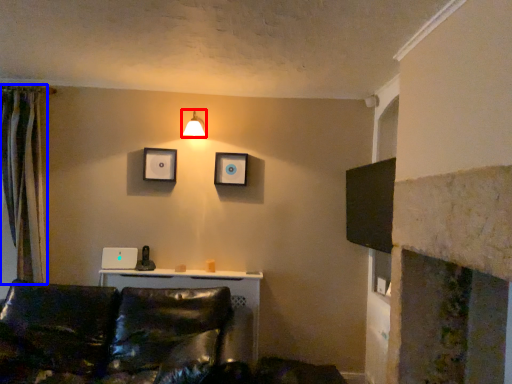
Question: Which of the following is the farthest to the observer, light fixture (highlighted by a red box) or curtain (highlighted by a blue box)?

Choices:
 (A) light fixture
 (B) curtain

Answer: (A)